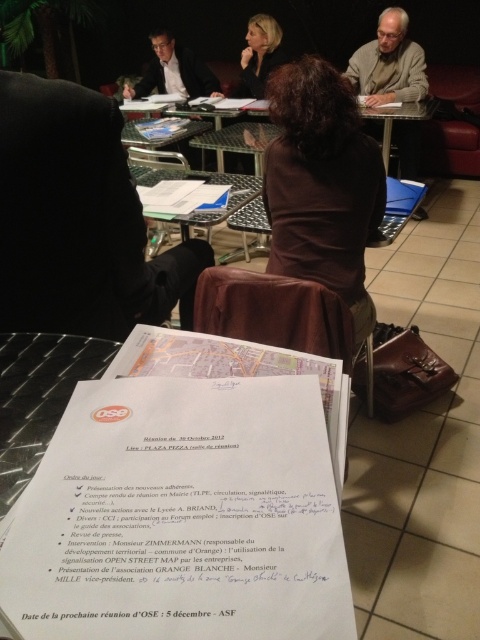
You are a photographer standing at the back of the room. You want to take a clear photo of the blonde hair at center. What should you consider about your current distance?

The blonde hair at center is 12.81 feet away from viewer. Since this distance is quite far, you might need to use a zoom lens or move closer to capture a clear photo.

You are a photographer trying to capture a candid shot of the meeting participants. You notice the matte black suit at upper left and the blonde hair at center. Which of these two would be more challenging to photograph clearly due to their position relative to the camera?

The matte black suit at upper left is taller than blonde hair at center, making it more challenging to photograph clearly because its height might cause the camera to focus on it first, potentially blurring the blonde hair at center in the background.

You are organizing a meeting and need to place a coffee mug on the table. The white paper at center and the light beige sweater at upper right are already there. Which object should you move to make space?

You should move the light beige sweater at upper right because it occupies more space than the white paper at center, making it easier to create space for the coffee mug.